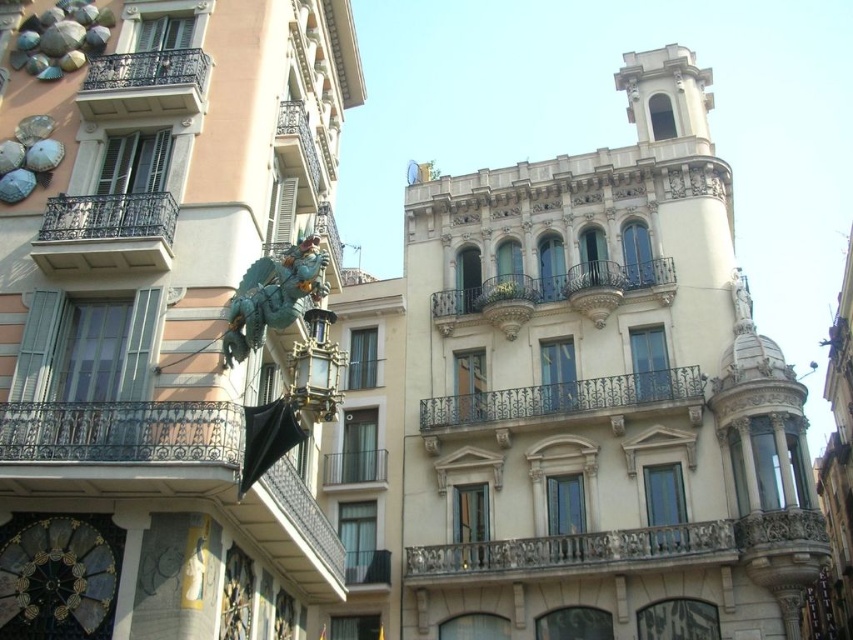
You are a window washer standing on the ground and need to clean both the dark blue wrought iron balcony at center and the dark brown wrought iron balcony at left. Which balcony will require you to use a taller ladder?

The dark blue wrought iron balcony at center has a greater height compared to the dark brown wrought iron balcony at left, so you will need a taller ladder for the dark blue wrought iron balcony at center.

You are standing at the entrance of the building on the left. You want to locate the dark blue wrought iron balcony at center. In which direction should you look relative to your current position?

The dark blue wrought iron balcony at center is located at coordinates 0.633 on the x axis and 0.660 on the y axis. Since you are at the entrance of the building on the left, you should look towards the right side to find it.

You are standing in front of the two buildings and want to take a photo that includes both points, point (107,83) and point (611,268). Which point should you focus on to ensure both are in sharp focus?

You should focus on point (611,268) because it is further away from the camera compared to point (107,83). By focusing on the farther point, the near point will also be within the depth of field, ensuring both are in focus.